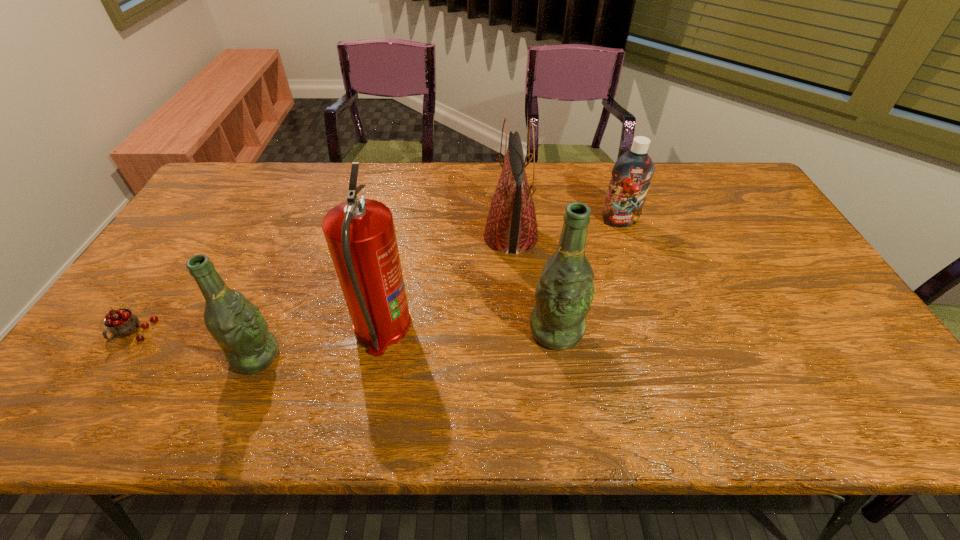
At what (x,y) coordinates should I click in order to perform the action: click on free space located on the front label of the shampoo. Please return your answer as a coordinate pair (x, y). The height and width of the screenshot is (540, 960). Looking at the image, I should click on (643, 291).

You are a GUI agent. You are given a task and a screenshot of the screen. Output one action in this format:
    pyautogui.click(x=<x>, y=<y>)
    Task: Click on the vacant space located 0.110m on the left of the handbag
    
    Given the screenshot: What is the action you would take?
    pyautogui.click(x=446, y=237)

Locate an element on the screen. This screenshot has width=960, height=540. free spot located on the instruction side of the fourth object from right to left is located at coordinates (561, 327).

Locate an element on the screen. The image size is (960, 540). fire extinguisher present at the near edge is located at coordinates (360, 234).

Find the location of a particular element. The image size is (960, 540). cherry that is at the near edge is located at coordinates (121, 323).

This screenshot has width=960, height=540. Identify the location of object that is at the left edge. (121, 323).

Image resolution: width=960 pixels, height=540 pixels. Identify the location of object that is at the near left corner. (121, 323).

In order to click on vacant space at the far edge in this screenshot , I will do `click(572, 166)`.

Identify the location of vacant region at the near edge of the desktop. The width and height of the screenshot is (960, 540). (526, 349).

Find the location of a particular element. The height and width of the screenshot is (540, 960). vacant space at the far left corner of the desktop is located at coordinates (215, 191).